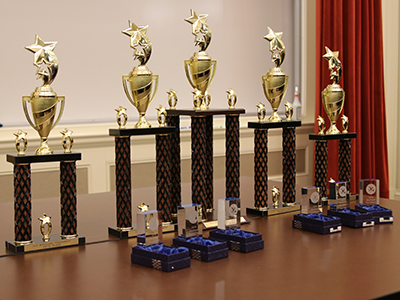
Locate an element on the screen. The height and width of the screenshot is (300, 400). red and black trophy bases is located at coordinates (25, 196), (65, 195), (126, 182), (166, 175), (198, 161), (232, 158), (259, 161), (289, 166), (319, 171), (345, 164).